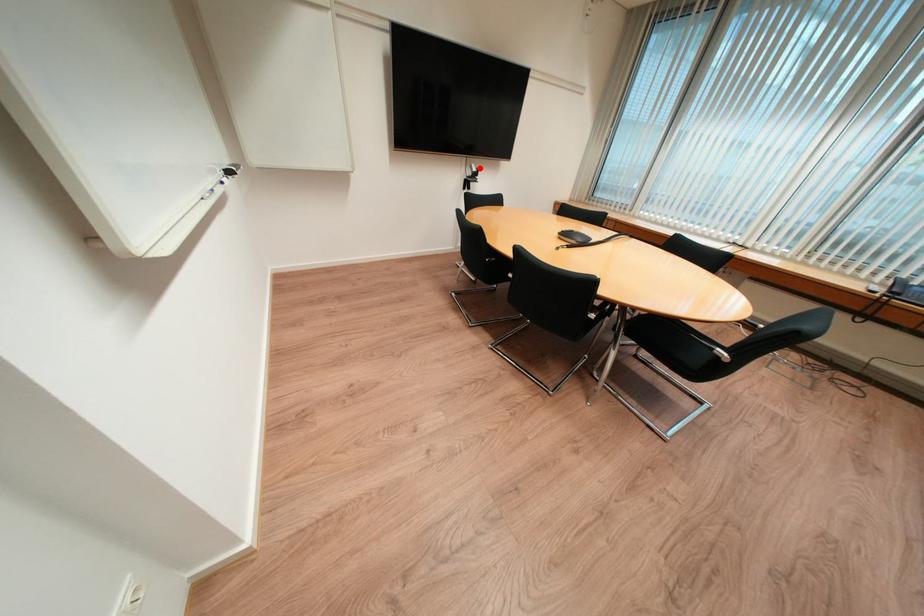
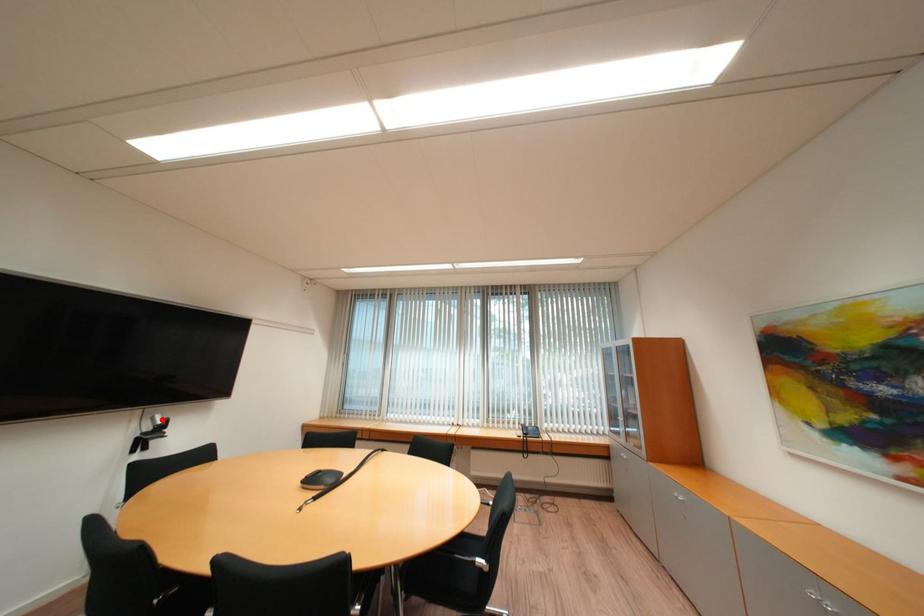
I am providing you with two images of the same scene from different viewpoints. A red point is marked on the first image and another point is marked on the second image. Are the points marked in image1 and image2 representing the same 3D position?

Yes